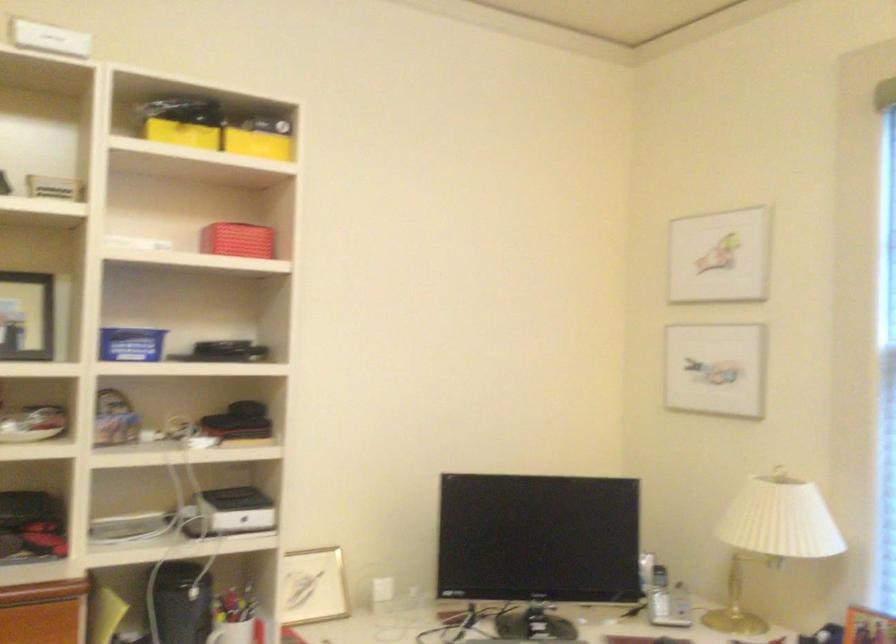
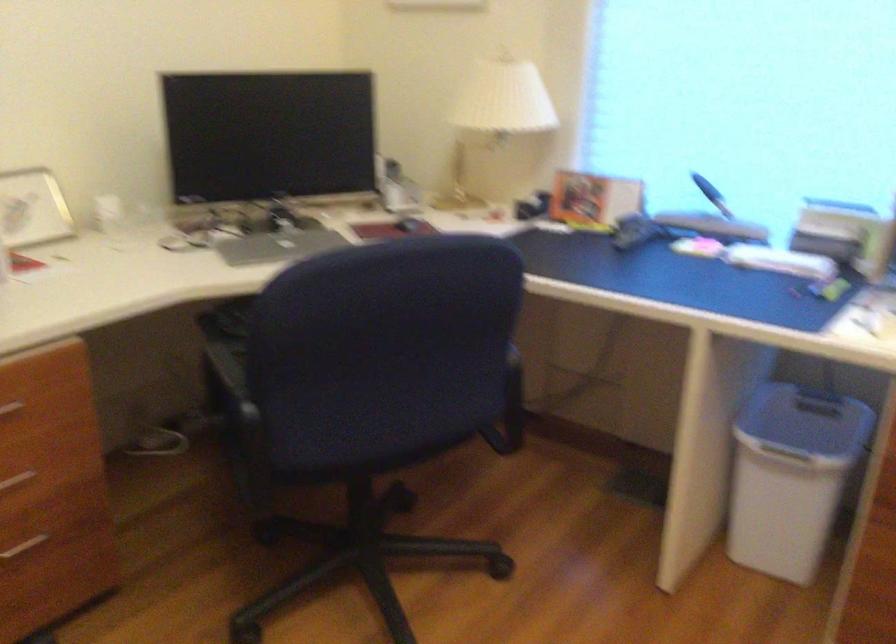
Based on the continuous images, in which direction is the camera rotating?

The rotation direction of the camera is right-down.